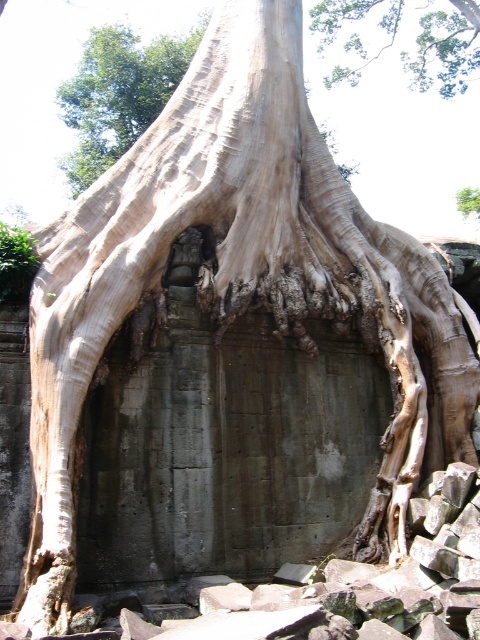
You are standing at the center of the image. Which direction should you look to see the green leafy tree at upper left?

The green leafy tree at upper left is located at point 0.148 on the x axis and 0.246 on the y axis, so you should look to the upper left direction to see it.